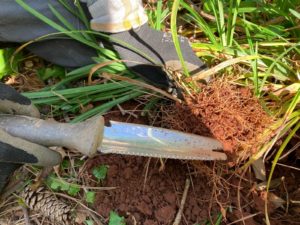
Image resolution: width=300 pixels, height=225 pixels. Find the location of `small "clover" plant`. small "clover" plant is located at coordinates (113, 214), (88, 195), (59, 186), (103, 176), (70, 163).